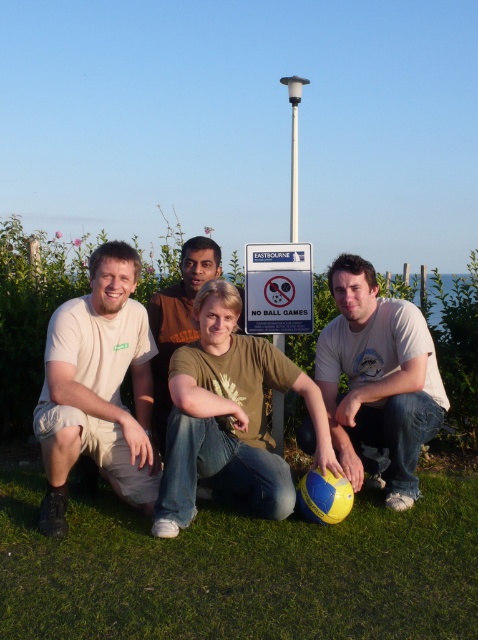
Question: Does volleyball at center appear over beige cotton t-shirt at left?

Choices:
 (A) yes
 (B) no

Answer: (B)

Question: Which point is farther from the camera taking this photo?

Choices:
 (A) (41, 397)
 (B) (299, 307)
 (C) (271, 624)

Answer: (B)

Question: Considering the relative positions of matte white t-shirt at center and green matte t-shirt at center in the image provided, where is matte white t-shirt at center located with respect to green matte t-shirt at center?

Choices:
 (A) above
 (B) below

Answer: (B)

Question: Can you confirm if beige cotton t-shirt at left is smaller than blue plastic sign at center?

Choices:
 (A) yes
 (B) no

Answer: (B)

Question: Among these objects, which one is nearest to the camera?

Choices:
 (A) beige cotton t-shirt at left
 (B) matte white t-shirt at center

Answer: (A)

Question: Which object is farther from the camera taking this photo?

Choices:
 (A) beige cotton t-shirt at left
 (B) matte white t-shirt at center
 (C) volleyball at center
 (D) green grass at lower center

Answer: (B)